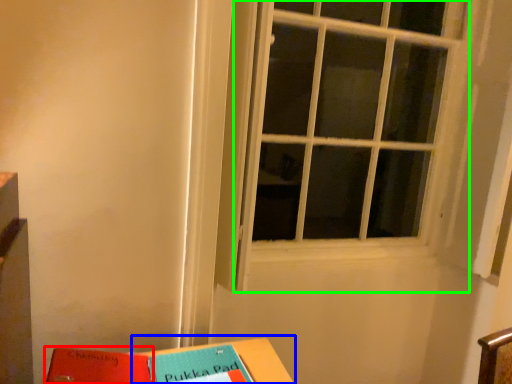
Question: Considering the real-world distances, which object is closest to paperback book (highlighted by a red box)? table (highlighted by a blue box) or window (highlighted by a green box).

Choices:
 (A) table
 (B) window

Answer: (A)